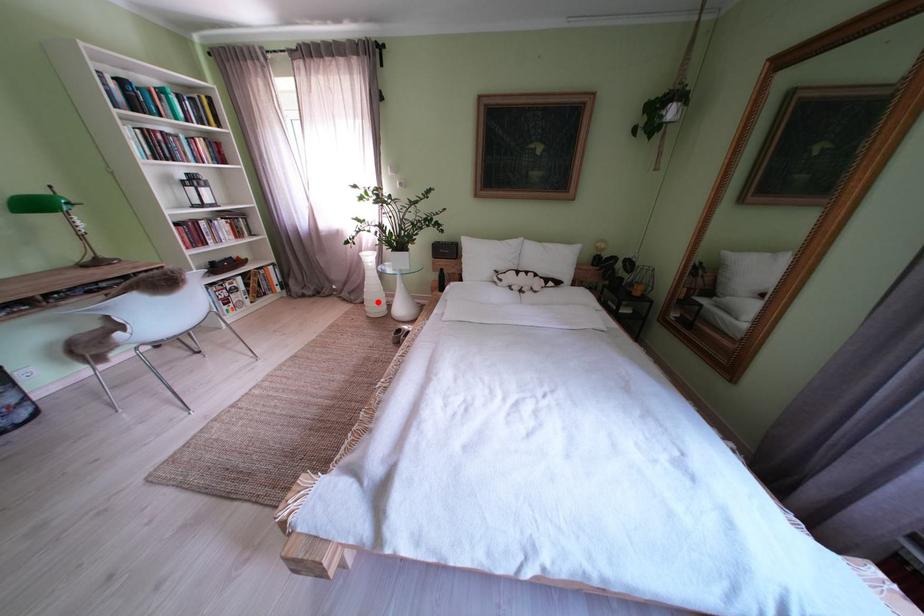
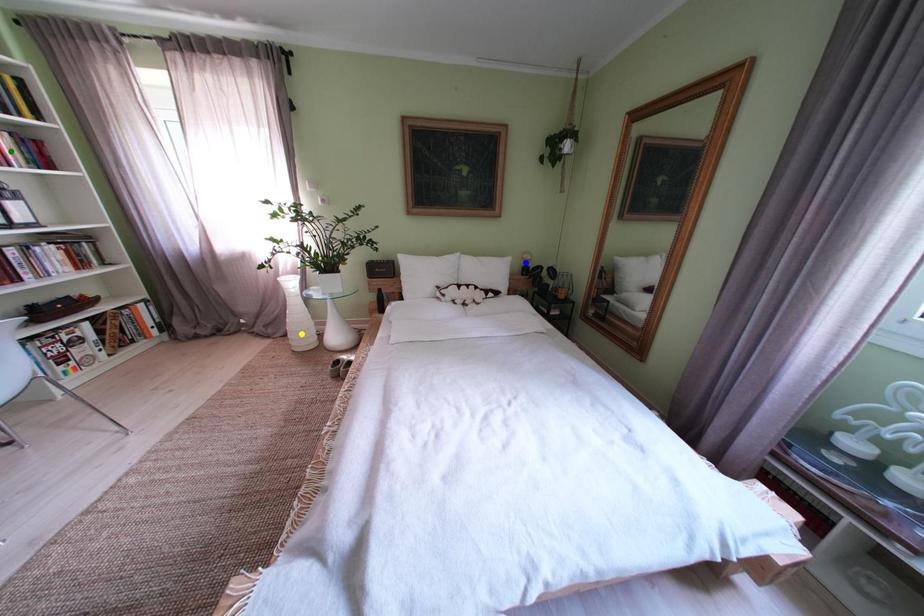
Question: I am providing you with two images of the same scene from different viewpoints. A red point is marked on the first image. You are given multiple points on the second image. Which point in image 2 is actually the same real-world point as the red point in image 1?

Choices:
 (A) yellow point
 (B) green point
 (C) blue point

Answer: (A)